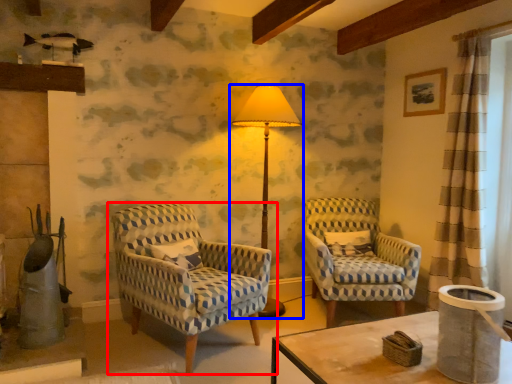
Question: Among these objects, which one is nearest to the camera, chair (highlighted by a red box) or lamp (highlighted by a blue box)?

Choices:
 (A) chair
 (B) lamp

Answer: (A)